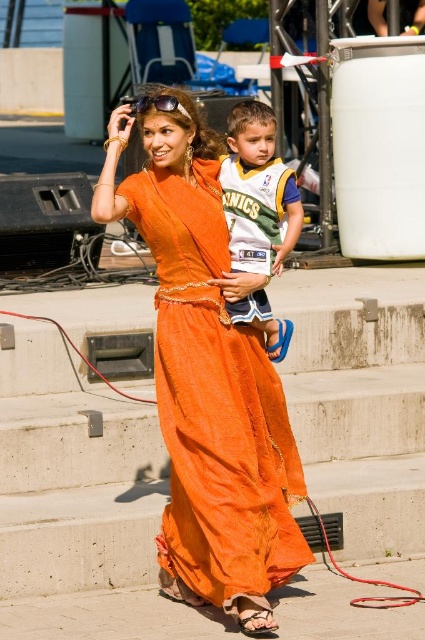
Question: Which point is closer to the camera taking this photo?

Choices:
 (A) (237, 400)
 (B) (283, 257)

Answer: (A)

Question: Can you confirm if orange silk dress at center is positioned above white jersey at center?

Choices:
 (A) no
 (B) yes

Answer: (A)

Question: Among these points, which one is nearest to the camera?

Choices:
 (A) (170, 396)
 (B) (231, 124)

Answer: (A)

Question: Where is orange silk dress at center located in relation to white jersey at center in the image?

Choices:
 (A) right
 (B) left

Answer: (B)

Question: Which point is closer to the camera?

Choices:
 (A) white jersey at center
 (B) orange silk dress at center

Answer: (B)

Question: Does orange silk dress at center appear on the left side of white jersey at center?

Choices:
 (A) no
 (B) yes

Answer: (B)